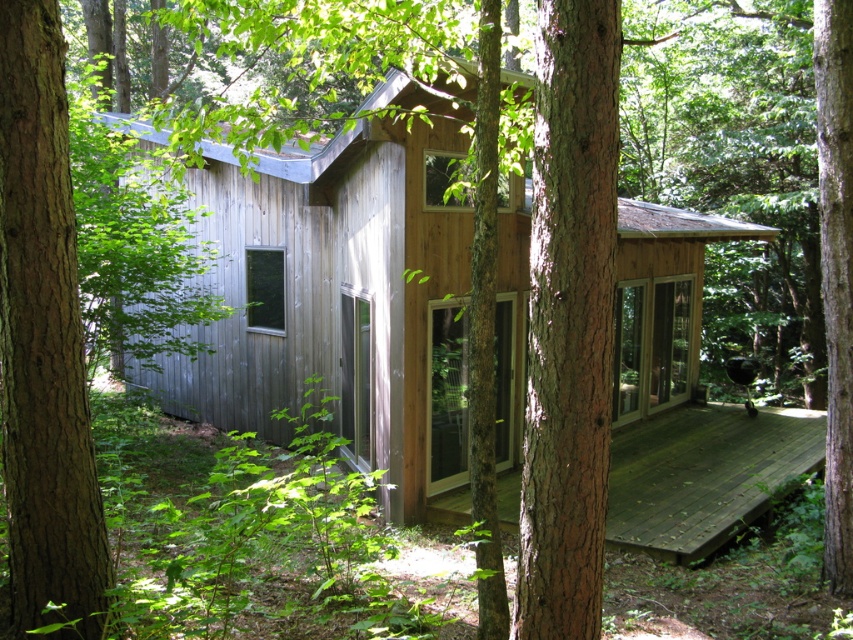
You are a carpenter who needs to choose between the brown rough tree trunk at left and the dark brown wooden deck at lower right for a project that requires a thicker material. Which object should you select?

The dark brown wooden deck at lower right is thicker than the brown rough tree trunk at left, so you should select the dark brown wooden deck at lower right for the project.

You are standing on the front porch of the cabin and want to walk to the brown rough tree trunk at center. Which direction should you move relative to the dark brown wooden deck at lower right?

You should move to the left of the dark brown wooden deck at lower right to reach the brown rough tree trunk at center because the deck is positioned to the right of the tree trunk.

You are standing at the center of the image. Which direction should you move to reach the dark brown wooden deck at lower right?

You should move towards the lower right direction to reach the dark brown wooden deck at lower right.